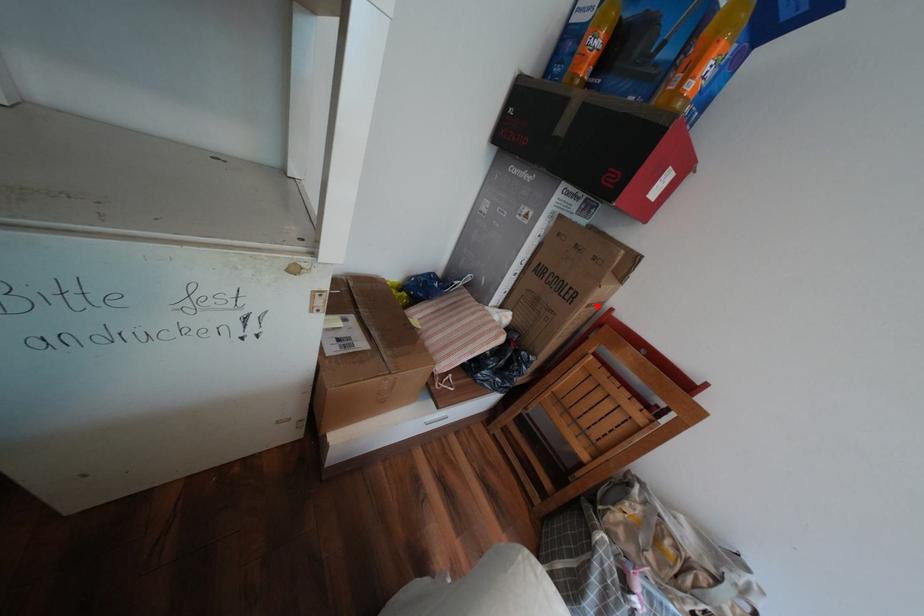
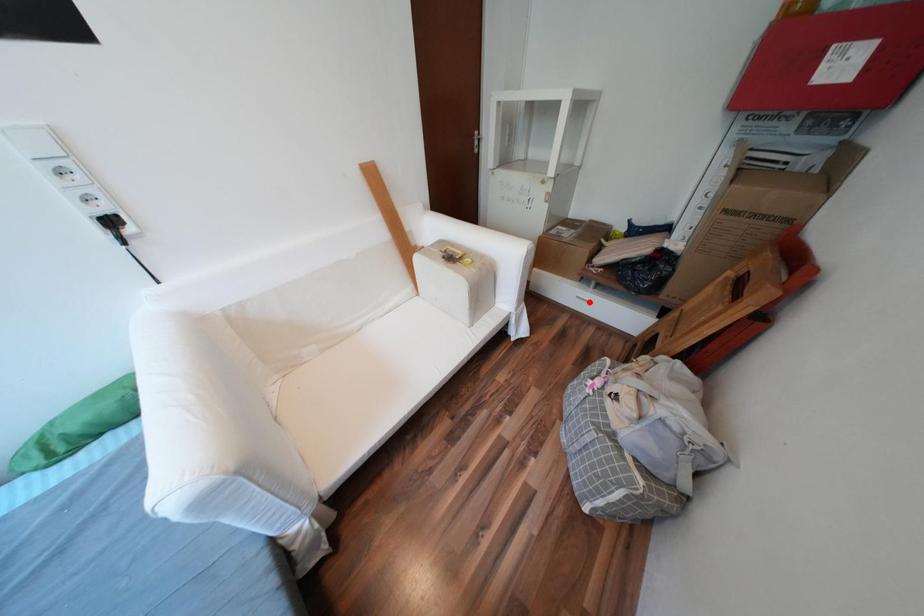
I am providing you with two images of the same scene from different viewpoints. A red point is marked on the first image and another point is marked on the second image. Are the points marked in image1 and image2 representing the same 3D position?

No